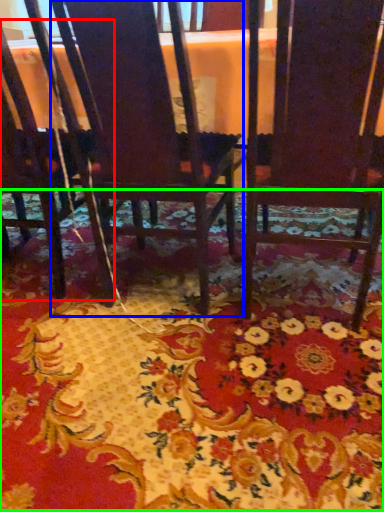
Question: Which is nearer to the chair (highlighted by a red box)? chair (highlighted by a blue box) or mat (highlighted by a green box).

Choices:
 (A) chair
 (B) mat

Answer: (A)